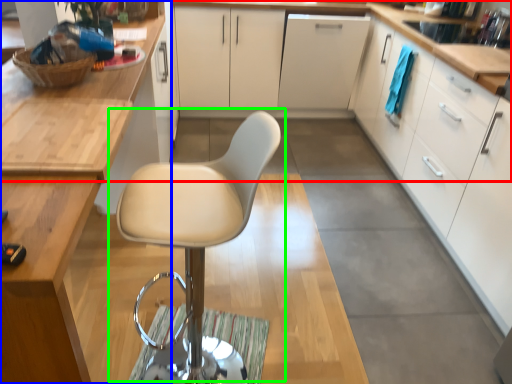
Question: Based on their relative distances, which object is nearer to countertop (highlighted by a red box)? Choose from cabinetry (highlighted by a blue box) and chair (highlighted by a green box).

Choices:
 (A) cabinetry
 (B) chair

Answer: (B)